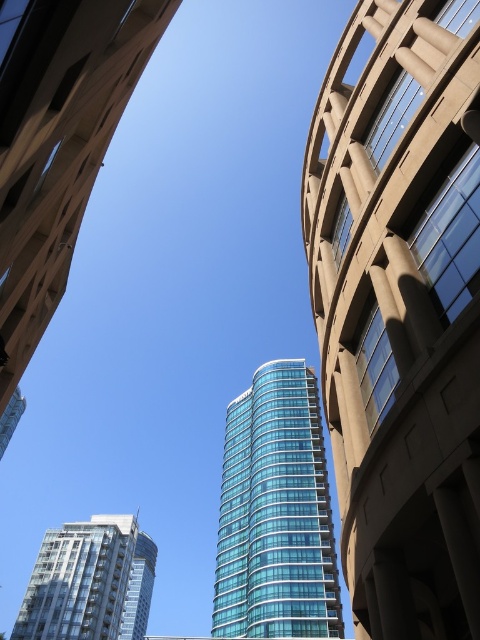
Question: Which point is closer to the camera taking this photo?

Choices:
 (A) (470, 460)
 (B) (8, 188)
 (C) (81, 560)

Answer: (A)

Question: Which object is the closest to the transparent glass tower at upper center?

Choices:
 (A) glassy teal tower at center
 (B) transparent glass building at center
 (C) glassy teal tower at lower left

Answer: (A)

Question: Can you confirm if glassy teal tower at center is thinner than transparent glass tower at upper center?

Choices:
 (A) yes
 (B) no

Answer: (A)

Question: Is glassy teal tower at center to the left of transparent glass building at center from the viewer's perspective?

Choices:
 (A) yes
 (B) no

Answer: (B)

Question: Does transparent glass tower at upper center have a smaller size compared to glassy teal tower at lower left?

Choices:
 (A) yes
 (B) no

Answer: (A)

Question: Which point is farther from the camera taking this photo?

Choices:
 (A) (466, 586)
 (B) (132, 582)
 (C) (6, 140)
 (D) (316, 621)

Answer: (B)